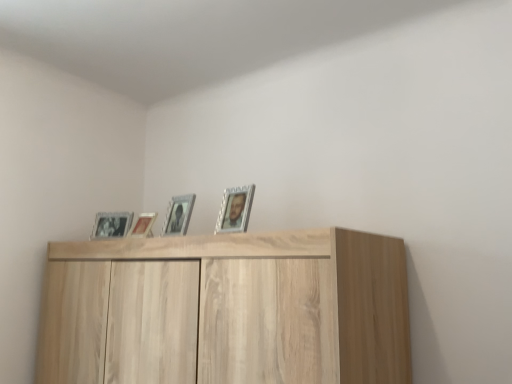
Image resolution: width=512 pixels, height=384 pixels. What do you see at coordinates (227, 309) in the screenshot?
I see `light wood cupboard at upper center` at bounding box center [227, 309].

Describe the element at coordinates (111, 224) in the screenshot. The width and height of the screenshot is (512, 384). I see `metallic silver photo frame at upper left, which appears as the 1th picture frame when viewed from the back` at that location.

This screenshot has width=512, height=384. What are the coordinates of `metallic silver photo frame at upper left, which is the first picture frame from left to right` in the screenshot? It's located at (111, 224).

Image resolution: width=512 pixels, height=384 pixels. Describe the element at coordinates (234, 209) in the screenshot. I see `silver metallic picture frame at upper center, which is the 1th picture frame from front to back` at that location.

The width and height of the screenshot is (512, 384). What do you see at coordinates (143, 225) in the screenshot?
I see `matte silver picture frame at center, which is the third picture frame in front-to-back order` at bounding box center [143, 225].

Find the location of a particular element. light wood cupboard at upper center is located at coordinates (227, 309).

From a real-world perspective, which is physically above, light wood cupboard at upper center or matte silver picture frame at center, which ranks as the second picture frame in back-to-front order?

matte silver picture frame at center, which ranks as the second picture frame in back-to-front order.

From the image's perspective, which is below, light wood cupboard at upper center or matte silver picture frame at center, which ranks as the second picture frame in back-to-front order?

light wood cupboard at upper center, from the image's perspective.

Who is bigger, light wood cupboard at upper center or matte silver picture frame at center, which is counted as the 2th picture frame, starting from the left?

light wood cupboard at upper center is bigger.

Does point (277, 326) come in front of point (156, 213)?

Yes, it is in front of point (156, 213).

Which object is closer to the camera, metallic silver picture frame at center, the 2th picture frame viewed from the right, or light wood cupboard at upper center?

light wood cupboard at upper center is more forward.

Does metallic silver picture frame at center, the third picture frame viewed from the back, have a greater width compared to light wood cupboard at upper center?

Incorrect, the width of metallic silver picture frame at center, the third picture frame viewed from the back, does not surpass that of light wood cupboard at upper center.

Is point (188, 209) closer or farther from the camera than point (161, 325)?

Point (188, 209).

From the picture: From a real-world perspective, is metallic silver picture frame at center, the third picture frame viewed from the back, above or below light wood cupboard at upper center?

From a real-world perspective, metallic silver picture frame at center, the third picture frame viewed from the back, is physically above light wood cupboard at upper center.

Is light wood cupboard at upper center directly adjacent to silver metallic picture frame at upper center, which is the 1th picture frame from front to back?

light wood cupboard at upper center is not next to silver metallic picture frame at upper center, which is the 1th picture frame from front to back, and they're not touching.

How much distance is there between light wood cupboard at upper center and silver metallic picture frame at upper center, the first picture frame in the right-to-left sequence?

17.04 inches.

Is light wood cupboard at upper center taller than silver metallic picture frame at upper center, the first picture frame in the right-to-left sequence?

Yes.

From a real-world perspective, which picture frame is the 4th one above the light wood cupboard at upper center? Please provide its 2D coordinates.

[(234, 209)]

Do you think light wood cupboard at upper center is within metallic silver picture frame at center, which is counted as the 2th picture frame, starting from the front, or outside of it?

light wood cupboard at upper center lies outside metallic silver picture frame at center, which is counted as the 2th picture frame, starting from the front.

Is light wood cupboard at upper center in front of or behind metallic silver picture frame at center, arranged as the third picture frame when viewed from the left, in the image?

In the image, light wood cupboard at upper center appears in front of metallic silver picture frame at center, arranged as the third picture frame when viewed from the left.

From their relative heights in the image, would you say light wood cupboard at upper center is taller or shorter than metallic silver picture frame at center, arranged as the third picture frame when viewed from the left?

Considering their sizes, light wood cupboard at upper center has more height than metallic silver picture frame at center, arranged as the third picture frame when viewed from the left.

Is silver metallic picture frame at upper center, the fourth picture frame when ordered from back to front, closer to camera compared to matte silver picture frame at center, arranged as the 3th picture frame when viewed from the right?

Yes, it is in front of matte silver picture frame at center, arranged as the 3th picture frame when viewed from the right.

How different are the orientations of silver metallic picture frame at upper center, the first picture frame in the right-to-left sequence, and matte silver picture frame at center, which ranks as the second picture frame in back-to-front order, in degrees?

silver metallic picture frame at upper center, the first picture frame in the right-to-left sequence, and matte silver picture frame at center, which ranks as the second picture frame in back-to-front order, are facing 4.81 degrees away from each other.

Would you say silver metallic picture frame at upper center, which is the 1th picture frame from front to back, is to the left or to the right of matte silver picture frame at center, which is the third picture frame in front-to-back order, in the picture?

silver metallic picture frame at upper center, which is the 1th picture frame from front to back, is positioned on matte silver picture frame at center, which is the third picture frame in front-to-back order,'s right side.

Can you confirm if silver metallic picture frame at upper center, the fourth picture frame when ordered from back to front, is bigger than matte silver picture frame at center, which is counted as the 2th picture frame, starting from the left?

Yes, silver metallic picture frame at upper center, the fourth picture frame when ordered from back to front, is bigger than matte silver picture frame at center, which is counted as the 2th picture frame, starting from the left.

Is point (151, 213) more distant than point (397, 349)?

Yes, point (151, 213) is behind point (397, 349).

Based on the photo, which is in front, matte silver picture frame at center, which ranks as the second picture frame in back-to-front order, or light wood cupboard at upper center?

Positioned in front is light wood cupboard at upper center.

From the image's perspective, is matte silver picture frame at center, which is the third picture frame in front-to-back order, below light wood cupboard at upper center?

No.

Is metallic silver picture frame at center, the 2th picture frame viewed from the right, aimed at silver metallic picture frame at upper center, which is the 1th picture frame from front to back?

No, metallic silver picture frame at center, the 2th picture frame viewed from the right, does not turn towards silver metallic picture frame at upper center, which is the 1th picture frame from front to back.

From the image's perspective, does metallic silver picture frame at center, the third picture frame viewed from the back, appear lower than silver metallic picture frame at upper center, which is the 1th picture frame from front to back?

Result: Yes, from the image's perspective, metallic silver picture frame at center, the third picture frame viewed from the back, is below silver metallic picture frame at upper center, which is the 1th picture frame from front to back.

Would you say metallic silver picture frame at center, the third picture frame viewed from the back, is a long distance from silver metallic picture frame at upper center, which is counted as the 4th picture frame, starting from the left?

No, metallic silver picture frame at center, the third picture frame viewed from the back, is in close proximity to silver metallic picture frame at upper center, which is counted as the 4th picture frame, starting from the left.

This screenshot has width=512, height=384. I want to click on picture frame on the right of metallic silver picture frame at center, which is counted as the 2th picture frame, starting from the front, so click(234, 209).

The image size is (512, 384). Identify the location of cupboard below the matte silver picture frame at center, arranged as the 3th picture frame when viewed from the right (from a real-world perspective). (227, 309).

Locate an element on the screen. This screenshot has width=512, height=384. picture frame that is the 3rd one above the light wood cupboard at upper center (from a real-world perspective) is located at coordinates (178, 215).

Based on their spatial positions, is metallic silver picture frame at center, which is counted as the 2th picture frame, starting from the front, or matte silver picture frame at center, which is the third picture frame in front-to-back order, further from light wood cupboard at upper center?

matte silver picture frame at center, which is the third picture frame in front-to-back order.

Looking at this image, estimate the real-world distances between objects in this image. Which object is further from metallic silver photo frame at upper left, the fourth picture frame when ordered from right to left, matte silver picture frame at center, which is counted as the 2th picture frame, starting from the left, or light wood cupboard at upper center?

light wood cupboard at upper center is further to metallic silver photo frame at upper left, the fourth picture frame when ordered from right to left.

Estimate the real-world distances between objects in this image. Which object is closer to metallic silver picture frame at center, arranged as the third picture frame when viewed from the left, matte silver picture frame at center, which ranks as the second picture frame in back-to-front order, or silver metallic picture frame at upper center, the first picture frame in the right-to-left sequence?

matte silver picture frame at center, which ranks as the second picture frame in back-to-front order.

Looking at this image, looking at the image, which one is located closer to matte silver picture frame at center, which is counted as the 2th picture frame, starting from the left, silver metallic picture frame at upper center, the first picture frame in the right-to-left sequence, or light wood cupboard at upper center?

silver metallic picture frame at upper center, the first picture frame in the right-to-left sequence, is closer to matte silver picture frame at center, which is counted as the 2th picture frame, starting from the left.

Estimate the real-world distances between objects in this image. Which object is further from metallic silver photo frame at upper left, which is the first picture frame from left to right, silver metallic picture frame at upper center, the fourth picture frame when ordered from back to front, or metallic silver picture frame at center, arranged as the third picture frame when viewed from the left?

The object further to metallic silver photo frame at upper left, which is the first picture frame from left to right, is silver metallic picture frame at upper center, the fourth picture frame when ordered from back to front.

Considering their positions, is silver metallic picture frame at upper center, the first picture frame in the right-to-left sequence, positioned closer to matte silver picture frame at center, which is counted as the 2th picture frame, starting from the left, than metallic silver photo frame at upper left, which appears as the 1th picture frame when viewed from the back?

The object closer to matte silver picture frame at center, which is counted as the 2th picture frame, starting from the left, is metallic silver photo frame at upper left, which appears as the 1th picture frame when viewed from the back.

Based on the photo, which object lies further to the anchor point silver metallic picture frame at upper center, the fourth picture frame when ordered from back to front, metallic silver photo frame at upper left, which appears as the 1th picture frame when viewed from the back, or matte silver picture frame at center, which ranks as the second picture frame in back-to-front order?

Based on the image, metallic silver photo frame at upper left, which appears as the 1th picture frame when viewed from the back, appears to be further to silver metallic picture frame at upper center, the fourth picture frame when ordered from back to front.

Looking at the image, which one is located further to metallic silver picture frame at center, which is counted as the 2th picture frame, starting from the front, silver metallic picture frame at upper center, which is counted as the 4th picture frame, starting from the left, or matte silver picture frame at center, which is the third picture frame in front-to-back order?

silver metallic picture frame at upper center, which is counted as the 4th picture frame, starting from the left, is positioned further to the anchor metallic silver picture frame at center, which is counted as the 2th picture frame, starting from the front.

Find the location of a particular element. This screenshot has height=384, width=512. picture frame situated between matte silver picture frame at center, which is the third picture frame in front-to-back order, and silver metallic picture frame at upper center, the fourth picture frame when ordered from back to front, from left to right is located at coordinates (178, 215).

Locate an element on the screen. This screenshot has width=512, height=384. picture frame situated between metallic silver photo frame at upper left, which ranks as the 4th picture frame in front-to-back order, and metallic silver picture frame at center, the 2th picture frame viewed from the right, from left to right is located at coordinates (143, 225).

This screenshot has height=384, width=512. Find the location of `picture frame between light wood cupboard at upper center and metallic silver picture frame at center, the 2th picture frame viewed from the right, in the front-back direction`. picture frame between light wood cupboard at upper center and metallic silver picture frame at center, the 2th picture frame viewed from the right, in the front-back direction is located at coordinates (234, 209).